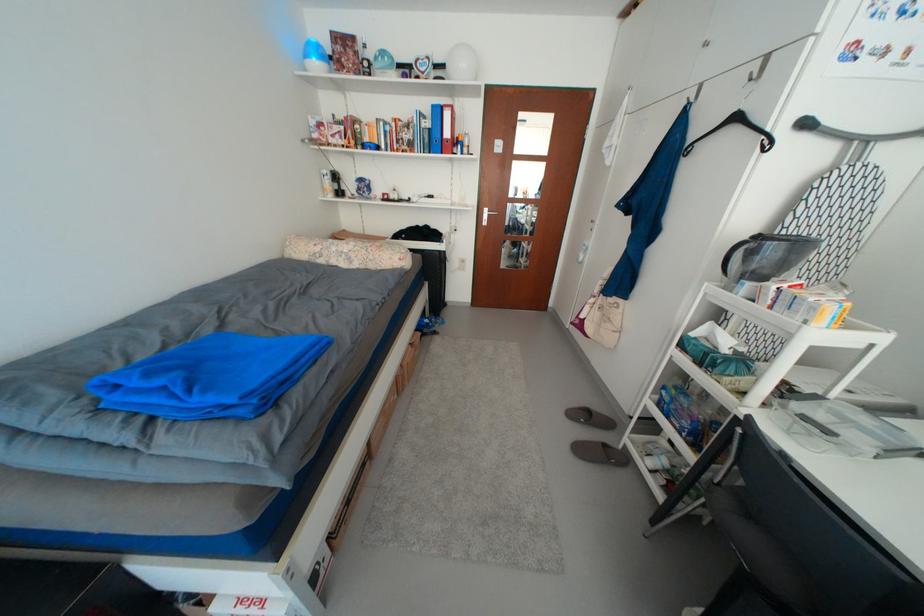
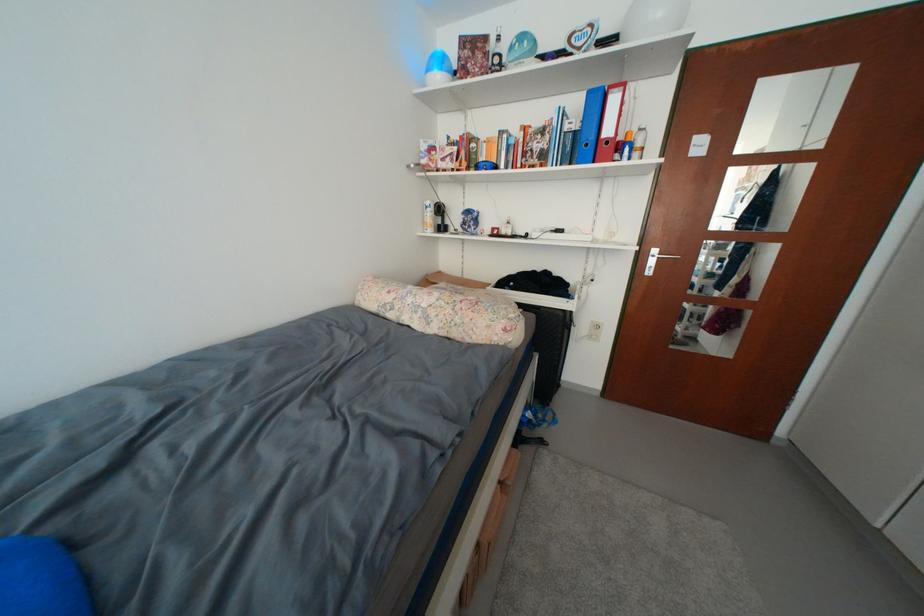
The point at (494, 213) is marked in the first image. Where is the corresponding point in the second image?

(663, 254)